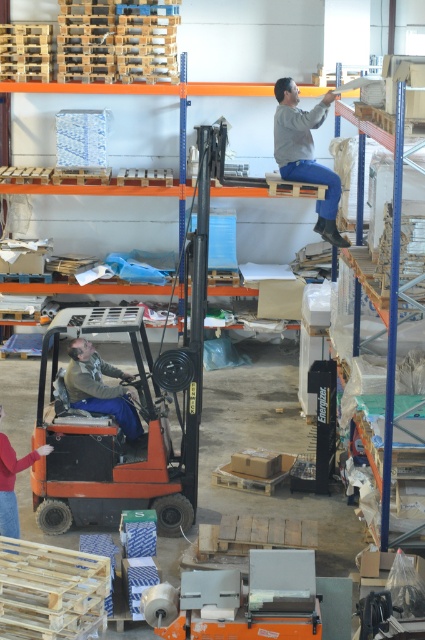
Question: Is gray fabric pants at upper center smaller than blue denim pants at lower left?

Choices:
 (A) yes
 (B) no

Answer: (B)

Question: Estimate the real-world distances between objects in this image. Which object is farther from the orange matte forklift at center?

Choices:
 (A) red sweater at lower left
 (B) gray fabric pants at upper center

Answer: (B)

Question: Does blue denim pants at lower left have a greater width compared to red sweater at lower left?

Choices:
 (A) yes
 (B) no

Answer: (A)

Question: Is orange matte forklift at center further to camera compared to gray fabric pants at upper center?

Choices:
 (A) no
 (B) yes

Answer: (A)

Question: Which of these objects is positioned closest to the gray fabric pants at upper center?

Choices:
 (A) orange matte forklift at center
 (B) blue denim pants at lower left
 (C) red sweater at lower left

Answer: (A)

Question: Which object is farther from the camera taking this photo?

Choices:
 (A) blue denim pants at lower left
 (B) orange matte forklift at center

Answer: (A)